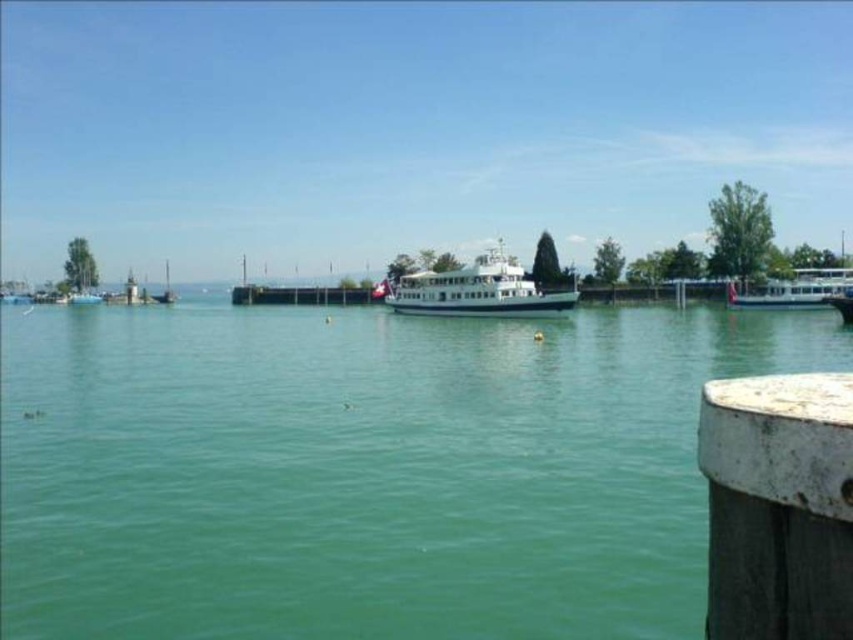
Where is `white glossy boat at right`? This screenshot has height=640, width=853. white glossy boat at right is located at coordinates (795, 289).

Is point (749, 307) farther from camera compared to point (169, 285)?

No, it is in front of (169, 285).

Where is `white glossy boat at right`? white glossy boat at right is located at coordinates pos(795,289).

Locate an element on the screen. The height and width of the screenshot is (640, 853). white glossy boat at right is located at coordinates (795, 289).

From the picture: Can you confirm if white glossy ferry at center is positioned to the left of white glossy boat at right?

Yes, white glossy ferry at center is to the left of white glossy boat at right.

Does white glossy ferry at center appear over white glossy boat at right?

Indeed, white glossy ferry at center is positioned over white glossy boat at right.

Does point (573, 301) lie in front of point (843, 291)?

That is True.

Identify the location of white glossy ferry at center. (477, 291).

Is green water at center further to the viewer compared to white weathered wood at lower right?

That is True.

Who is taller, green water at center or white weathered wood at lower right?

green water at center is taller.

Is point (648, 600) positioned behind point (712, 406)?

Yes, point (648, 600) is farther from viewer.

Identify the location of green water at center. (366, 468).